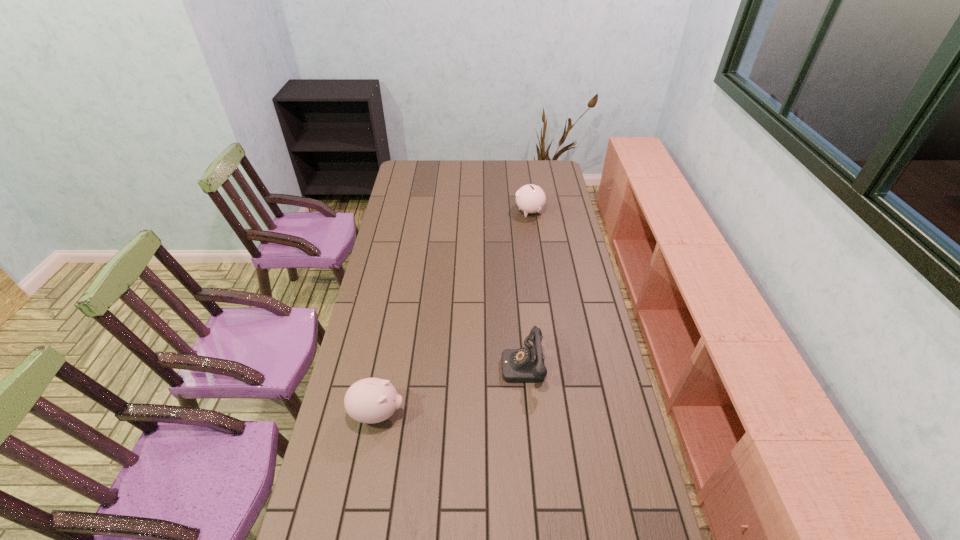
The image size is (960, 540). I want to click on object that is at the left edge, so [371, 400].

Where is `object present at the right edge`? object present at the right edge is located at coordinates (530, 198).

You are a GUI agent. You are given a task and a screenshot of the screen. Output one action in this format:
    pyautogui.click(x=<x>, y=<y>)
    Task: Click on the vacant space at the far edge of the desktop
    The image size is (960, 540).
    Given the screenshot: What is the action you would take?
    pyautogui.click(x=494, y=168)

Identify the location of free space at the left edge of the desktop. (372, 350).

I want to click on free region at the right edge of the desktop, so click(556, 186).

Locate an element on the screen. blank space at the far left corner of the desktop is located at coordinates (423, 173).

This screenshot has width=960, height=540. Find the location of `vacant space that is in between the farthest object and the second farthest object`. vacant space that is in between the farthest object and the second farthest object is located at coordinates (526, 288).

Where is `blank region between the farthest object and the second nearest object`? blank region between the farthest object and the second nearest object is located at coordinates (526, 288).

Image resolution: width=960 pixels, height=540 pixels. Find the location of `free space between the second farthest object and the left piggy bank`. free space between the second farthest object and the left piggy bank is located at coordinates (450, 389).

Identify the location of free space between the nearer piggy bank and the farthest object. (453, 313).